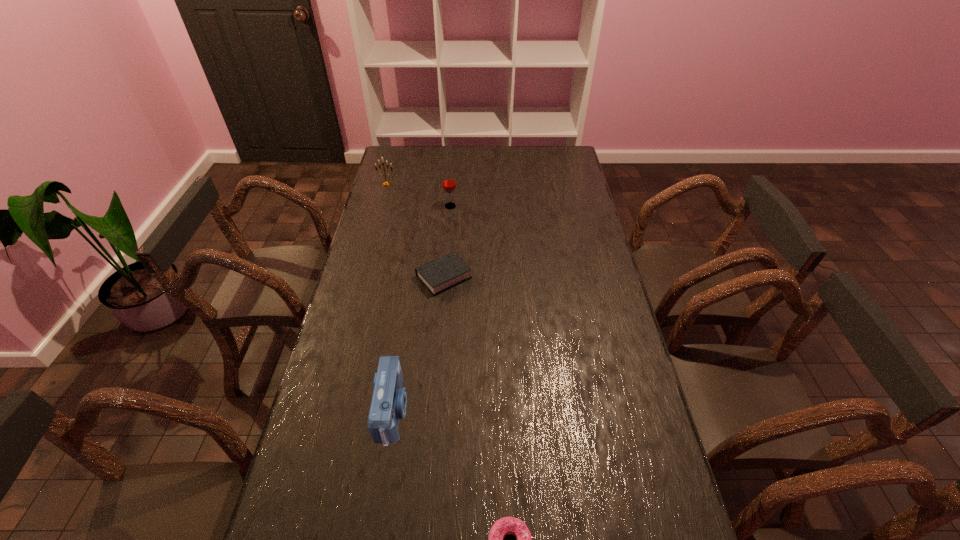
Find the location of a particular element. The width and height of the screenshot is (960, 540). the fourth nearest object is located at coordinates (448, 182).

Image resolution: width=960 pixels, height=540 pixels. In order to click on the leftmost object in this screenshot , I will do `click(386, 183)`.

At what (x,y) coordinates should I click in order to perform the action: click on the farthest object. Please return your answer as a coordinate pair (x, y). This screenshot has height=540, width=960. Looking at the image, I should click on (386, 183).

Locate an element on the screen. Image resolution: width=960 pixels, height=540 pixels. camera is located at coordinates (389, 400).

Find the location of a particular element. the third nearest object is located at coordinates (438, 275).

Locate an element on the screen. Image resolution: width=960 pixels, height=540 pixels. vacant position located 0.320m on the front of the fourth nearest object is located at coordinates (446, 262).

Where is `vacant space situated 0.100m on the back of the candelabrum`? vacant space situated 0.100m on the back of the candelabrum is located at coordinates coord(391,170).

Where is `free spot located 0.310m on the lens of the second nearest object`? free spot located 0.310m on the lens of the second nearest object is located at coordinates (520, 411).

Find the location of a particular element. This screenshot has width=960, height=540. vacant space situated on the back of the Bible is located at coordinates (448, 221).

You are a GUI agent. You are given a task and a screenshot of the screen. Output one action in this format:
    pyautogui.click(x=<x>, y=<y>)
    Task: Click on the object that is at the left edge
    The image size is (960, 540).
    Given the screenshot: What is the action you would take?
    pyautogui.click(x=386, y=183)